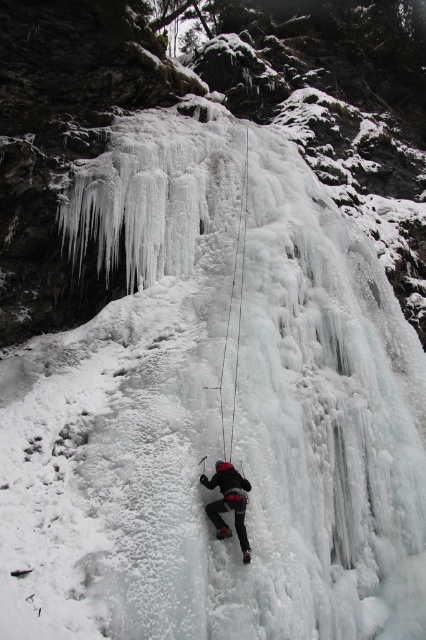
Question: Which point is closer to the camera taking this photo?

Choices:
 (A) (249, 134)
 (B) (247, 536)

Answer: (B)

Question: Is clear ice rope at center to the left of black matte climbing gear at center from the viewer's perspective?

Choices:
 (A) yes
 (B) no

Answer: (B)

Question: Does clear ice rope at center have a larger size compared to black matte climbing gear at center?

Choices:
 (A) yes
 (B) no

Answer: (A)

Question: Which of the following is the closest to the observer?

Choices:
 (A) (213, 483)
 (B) (224, 428)

Answer: (A)

Question: Is clear ice rope at center smaller than black matte climbing gear at center?

Choices:
 (A) yes
 (B) no

Answer: (B)

Question: Which point is closer to the camera?

Choices:
 (A) (235, 509)
 (B) (233, 355)

Answer: (A)